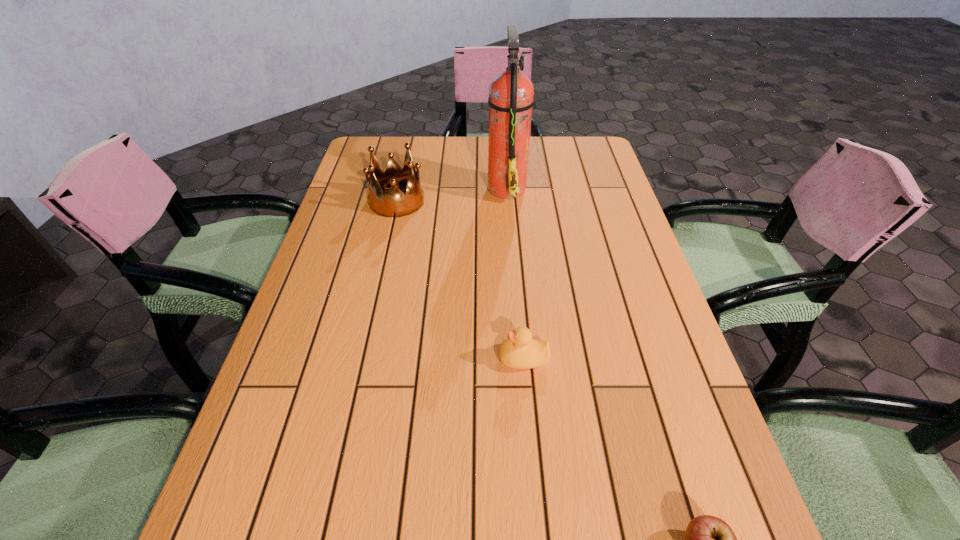
Identify the location of the tallest object. The image size is (960, 540). (511, 93).

The image size is (960, 540). Find the location of `the leftmost object`. the leftmost object is located at coordinates (395, 204).

At what (x,y) coordinates should I click in order to perform the action: click on the third shortest object. Please return your answer as a coordinate pair (x, y). The width and height of the screenshot is (960, 540). Looking at the image, I should click on (x=395, y=204).

This screenshot has width=960, height=540. I want to click on duck, so click(519, 350).

You are a GUI agent. You are given a task and a screenshot of the screen. Output one action in this format:
    pyautogui.click(x=<x>, y=<y>)
    Task: Click on the free spot located 0.060m at the nozzle of the tallest object
    The height and width of the screenshot is (540, 960).
    Given the screenshot: What is the action you would take?
    pyautogui.click(x=467, y=187)

What are the coordinates of `vacant area located at the nozzle of the tallest object` in the screenshot? It's located at (430, 187).

Find the location of `vacant region located 0.330m at the nozzle of the tallest object`. vacant region located 0.330m at the nozzle of the tallest object is located at coordinates (376, 187).

Find the location of a particular element. The image size is (960, 540). free region located on the back of the second tallest object is located at coordinates (403, 171).

Locate an element on the screen. This screenshot has height=540, width=960. vacant position located 0.160m on the face of the duck is located at coordinates (420, 358).

The image size is (960, 540). Find the location of `vacant space located 0.180m on the face of the duck`. vacant space located 0.180m on the face of the duck is located at coordinates (409, 358).